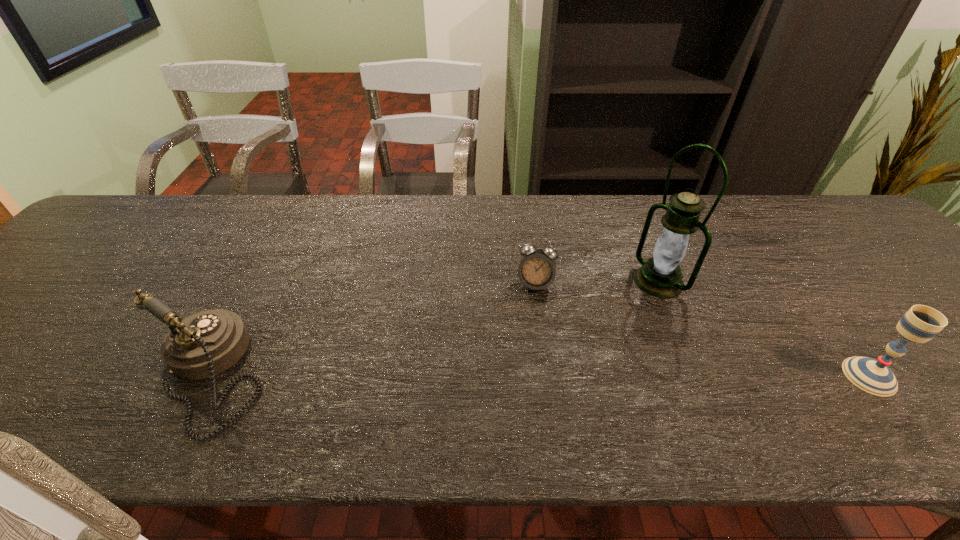
In order to click on free space on the desktop that is between the telephone and the rightmost object and is positioned on the side where the lantern emits light in this screenshot , I will do `click(515, 375)`.

Locate an element on the screen. Image resolution: width=960 pixels, height=540 pixels. free space on the desktop that is between the leftmost object and the chalice and is positioned on the face of the third object from right to left is located at coordinates (522, 375).